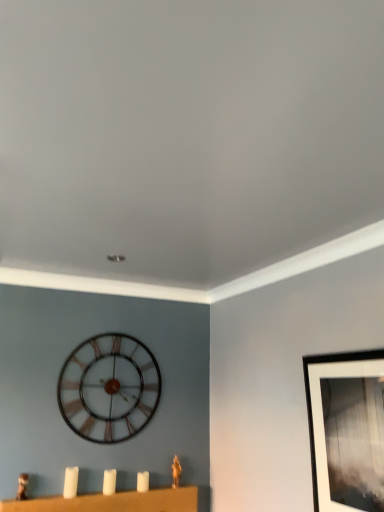
Question: From the image's perspective, does white matte candle at lower left appear lower than black matte picture frame at upper right?

Choices:
 (A) yes
 (B) no

Answer: (A)

Question: Considering the relative positions of white matte candle at lower left and black matte picture frame at upper right in the image provided, is white matte candle at lower left to the left of black matte picture frame at upper right from the viewer's perspective?

Choices:
 (A) no
 (B) yes

Answer: (B)

Question: From a real-world perspective, does white matte candle at lower left stand above black matte picture frame at upper right?

Choices:
 (A) no
 (B) yes

Answer: (A)

Question: Does white matte candle at lower left have a greater width compared to black matte picture frame at upper right?

Choices:
 (A) yes
 (B) no

Answer: (A)

Question: Does white matte candle at lower left have a lesser width compared to black matte picture frame at upper right?

Choices:
 (A) yes
 (B) no

Answer: (B)

Question: Considering the relative sizes of white matte candle at lower left and black matte picture frame at upper right in the image provided, is white matte candle at lower left smaller than black matte picture frame at upper right?

Choices:
 (A) no
 (B) yes

Answer: (B)

Question: Can you see white matte candlesticks at lower center touching black matte picture frame at upper right?

Choices:
 (A) yes
 (B) no

Answer: (B)

Question: Is white matte candlesticks at lower center thinner than black matte picture frame at upper right?

Choices:
 (A) no
 (B) yes

Answer: (A)

Question: Is white matte candlesticks at lower center at the left side of black matte picture frame at upper right?

Choices:
 (A) yes
 (B) no

Answer: (A)

Question: Is white matte candlesticks at lower center closer to camera compared to black matte picture frame at upper right?

Choices:
 (A) no
 (B) yes

Answer: (A)

Question: Is white matte candlesticks at lower center far from black matte picture frame at upper right?

Choices:
 (A) yes
 (B) no

Answer: (A)

Question: Is white matte candlesticks at lower center wider than black matte picture frame at upper right?

Choices:
 (A) no
 (B) yes

Answer: (B)

Question: Does metallic clock at center have a greater height compared to white matte candlesticks at lower center?

Choices:
 (A) yes
 (B) no

Answer: (A)